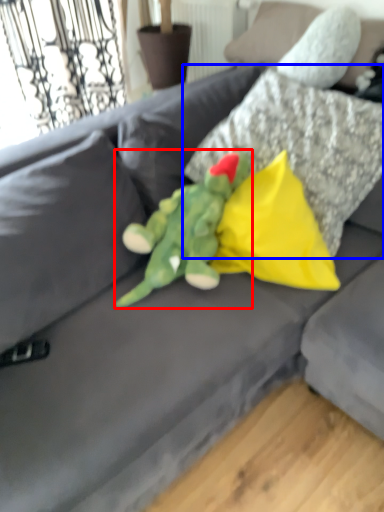
Question: Among these objects, which one is nearest to the camera, toy (highlighted by a red box) or pillow (highlighted by a blue box)?

Choices:
 (A) toy
 (B) pillow

Answer: (A)